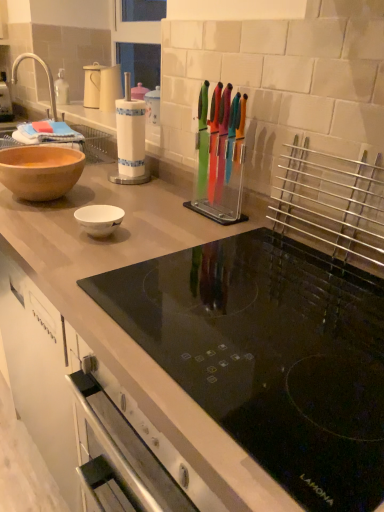
Question: From the image's perspective, is white paper towel holder at center, which is counted as the 2th appliance, starting from the right, above or below matte brown bowl at left?

Choices:
 (A) above
 (B) below

Answer: (A)

Question: From a real-world perspective, is white paper towel holder at center, which is counted as the second appliance, starting from the front, physically located above or below matte brown bowl at left?

Choices:
 (A) below
 (B) above

Answer: (B)

Question: Based on their relative distances, which object is farther from the transparent plastic knife block at center, which ranks as the 1th appliance in front-to-back order?

Choices:
 (A) matte brown bowl at left
 (B) brushed metal faucet at upper left
 (C) white paper towel holder at center, the 1th appliance in the back-to-front sequence
 (D) matte white container at upper left

Answer: (B)

Question: Estimate the real-world distances between objects in this image. Which object is farther from the brushed metal faucet at upper left?

Choices:
 (A) matte white container at upper left
 (B) transparent plastic knife block at center, which ranks as the 1th appliance in front-to-back order
 (C) white paper towel holder at center, which is counted as the second appliance, starting from the front
 (D) matte brown bowl at left

Answer: (B)